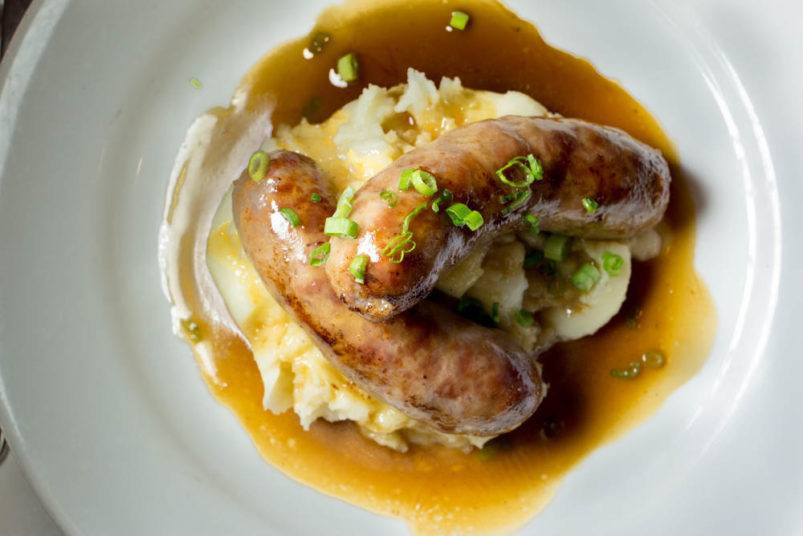
Where is `utensil`? utensil is located at coordinates [2, 446].